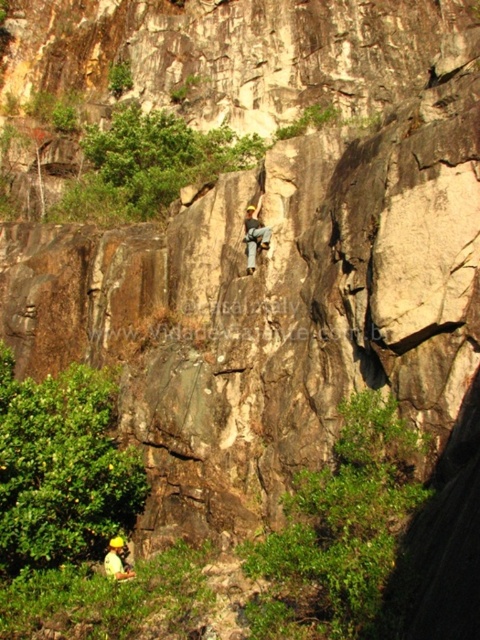
How distant is light brown leather harness at center from yellow helmeted climber at center?

They are 25.42 meters apart.

Which is above, light brown leather harness at center or yellow helmeted climber at center?

light brown leather harness at center is above.

Is point (251, 243) positioned behind point (128, 573)?

Yes, it is.

Find the location of a particular element. The image size is (480, 640). light brown leather harness at center is located at coordinates (254, 234).